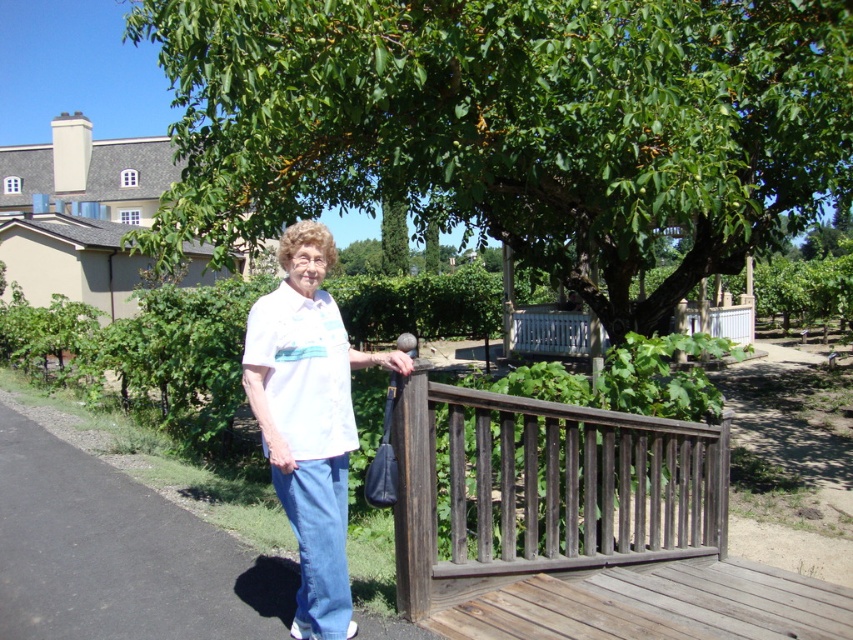
Between green leafy tree at center and smooth asphalt path at center, which one has more height?

green leafy tree at center

Which of these two, green leafy tree at center or smooth asphalt path at center, stands shorter?

With less height is smooth asphalt path at center.

Between point (253, 92) and point (126, 628), which one is positioned behind?

Point (253, 92)

The image size is (853, 640). Identify the location of green leafy tree at center. (514, 125).

Does smooth asphalt path at center have a greater width compared to weathered wood deck at lower right?

In fact, smooth asphalt path at center might be narrower than weathered wood deck at lower right.

You are a GUI agent. You are given a task and a screenshot of the screen. Output one action in this format:
    pyautogui.click(x=<x>, y=<y>)
    Task: Click on the smooth asphalt path at center
    This screenshot has height=640, width=853.
    Given the screenshot: What is the action you would take?
    pyautogui.click(x=119, y=554)

Does green leafy tree at center have a lesser height compared to dark brown wood at center?

No, green leafy tree at center is not shorter than dark brown wood at center.

How distant is green leafy tree at center from dark brown wood at center?

A distance of 2.57 meters exists between green leafy tree at center and dark brown wood at center.

Which is in front, point (465, 163) or point (532, 502)?

Positioned in front is point (532, 502).

Where is `green leafy tree at center`? This screenshot has height=640, width=853. green leafy tree at center is located at coordinates (514, 125).